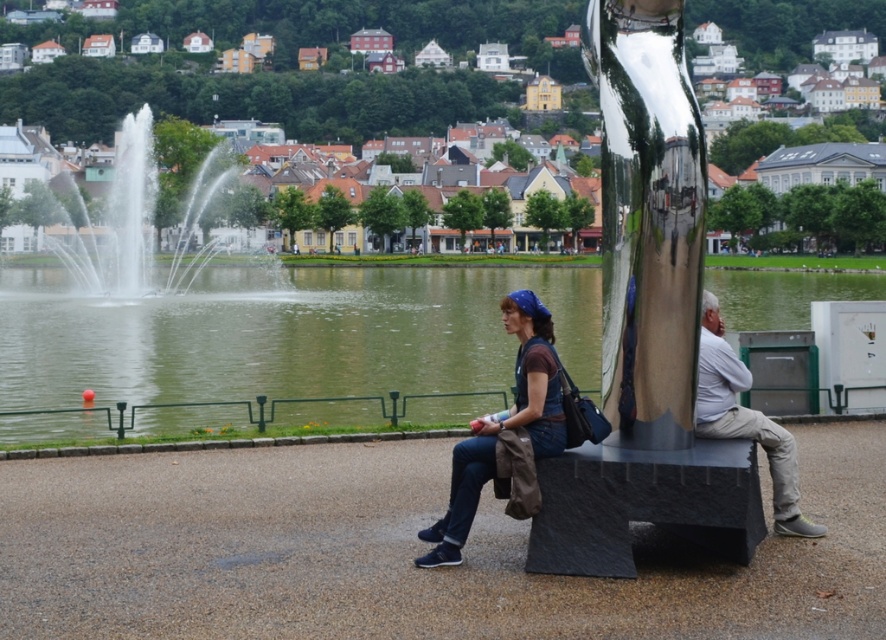
Who is higher up, black textured bench at lower right or white water at center?

white water at center is higher up.

Is point (587, 508) closer to viewer compared to point (144, 152)?

Yes, point (587, 508) is closer to viewer.

You are a GUI agent. You are given a task and a screenshot of the screen. Output one action in this format:
    pyautogui.click(x=<x>, y=<y>)
    Task: Click on the black textured bench at lower right
    
    Given the screenshot: What is the action you would take?
    pyautogui.click(x=643, y=504)

Who is higher up, matte brown jacket at center or white water at center?

white water at center is above.

Does point (535, 344) lie behind point (103, 269)?

No, (535, 344) is in front of (103, 269).

Find the location of a particular element. This screenshot has height=640, width=886. matte brown jacket at center is located at coordinates (639, 500).

What are the coordinates of `matte black shirt at center` in the screenshot? It's located at (503, 426).

Does matte black shirt at center have a larger size compared to light gray cotton pants at right?

Actually, matte black shirt at center might be smaller than light gray cotton pants at right.

Is point (452, 465) closer to camera compared to point (739, 413)?

Yes.

This screenshot has width=886, height=640. I want to click on matte black shirt at center, so click(503, 426).